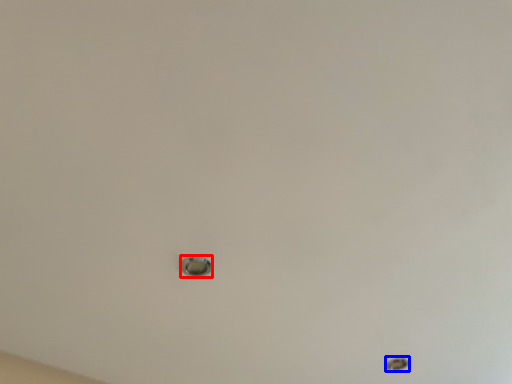
Question: Among these objects, which one is nearest to the camera, knob (highlighted by a red box) or hole (highlighted by a blue box)?

Choices:
 (A) knob
 (B) hole

Answer: (A)